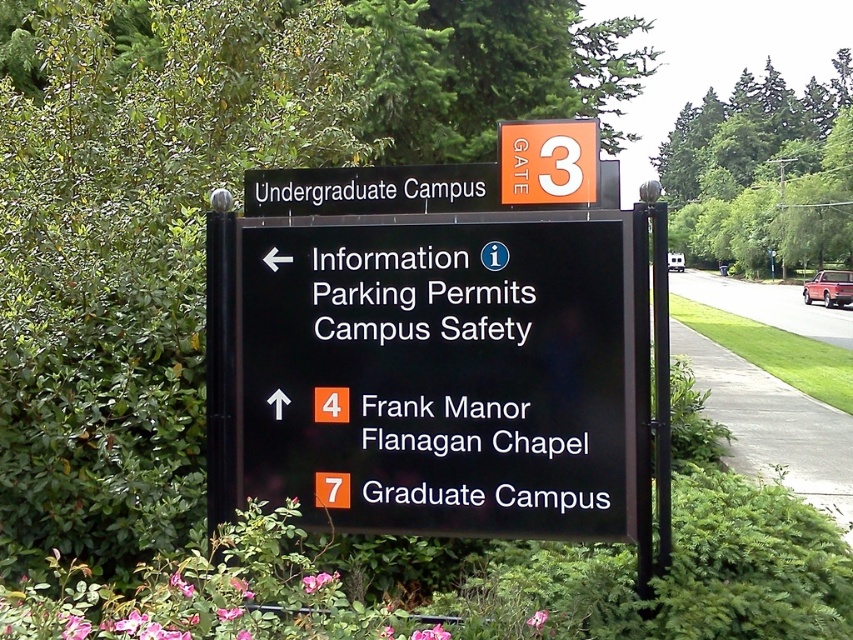
Question: Can you confirm if black plastic sign at upper center is wider than orange matte gate at upper center?

Choices:
 (A) no
 (B) yes

Answer: (B)

Question: Among these points, which one is farthest from the camera?

Choices:
 (A) (386, 355)
 (B) (544, 125)
 (C) (247, 195)

Answer: (C)

Question: Which point is farther from the camera taking this photo?

Choices:
 (A) (483, 435)
 (B) (520, 125)

Answer: (B)

Question: Can you confirm if black plastic sign at upper center is bigger than orange matte gate at upper center?

Choices:
 (A) no
 (B) yes

Answer: (B)

Question: Is black plastic sign at upper center positioned before orange matte gate at upper center?

Choices:
 (A) yes
 (B) no

Answer: (B)

Question: Estimate the real-world distances between objects in this image. Which object is closer to the black plastic sign at upper center?

Choices:
 (A) orange matte gate at upper center
 (B) black plastic sign at center

Answer: (A)